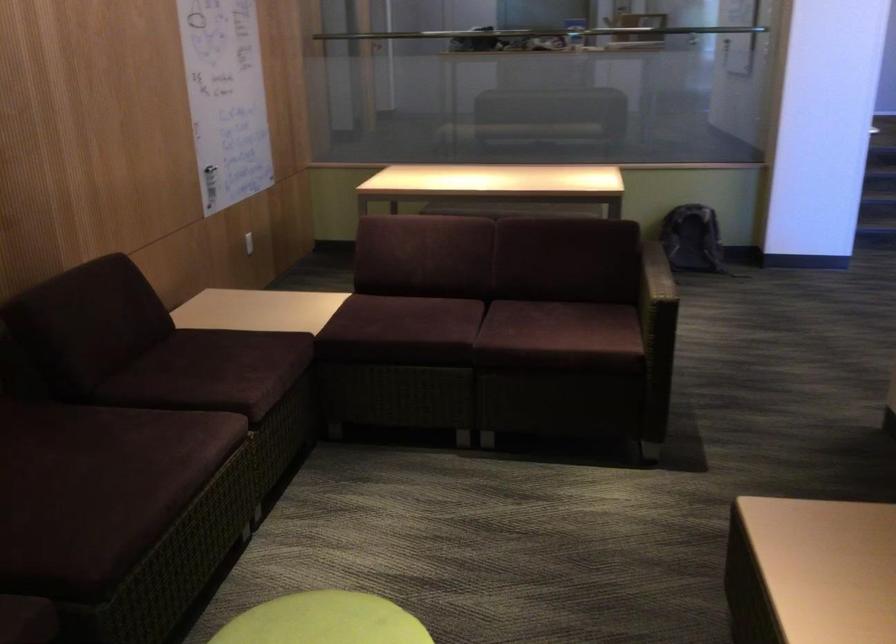
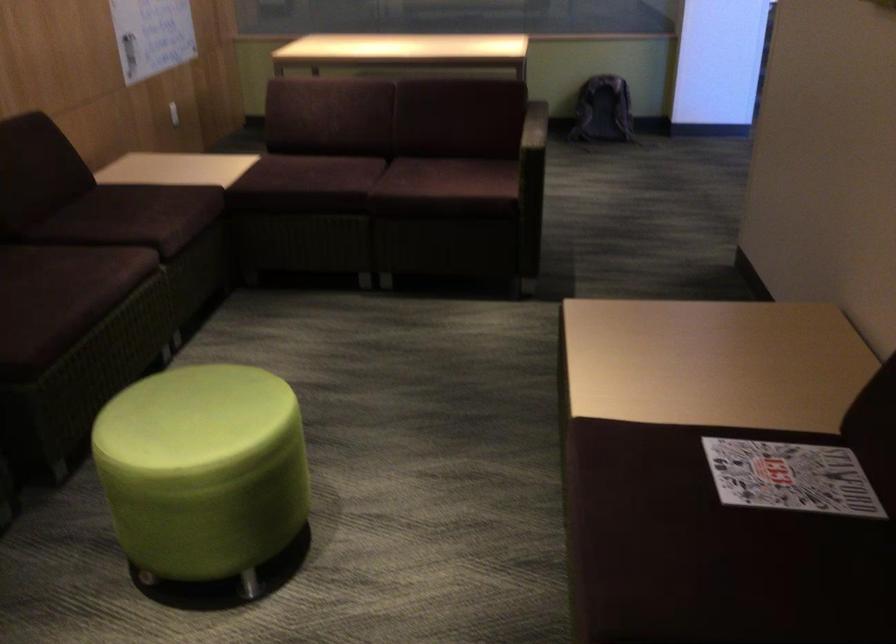
Find the pixel in the second image that matches (x=119, y=495) in the first image.

(44, 301)